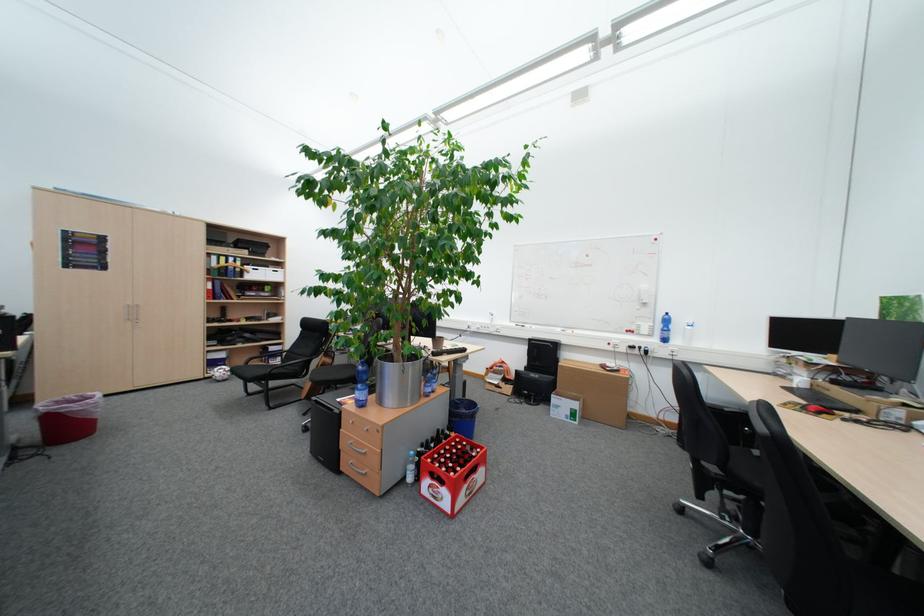
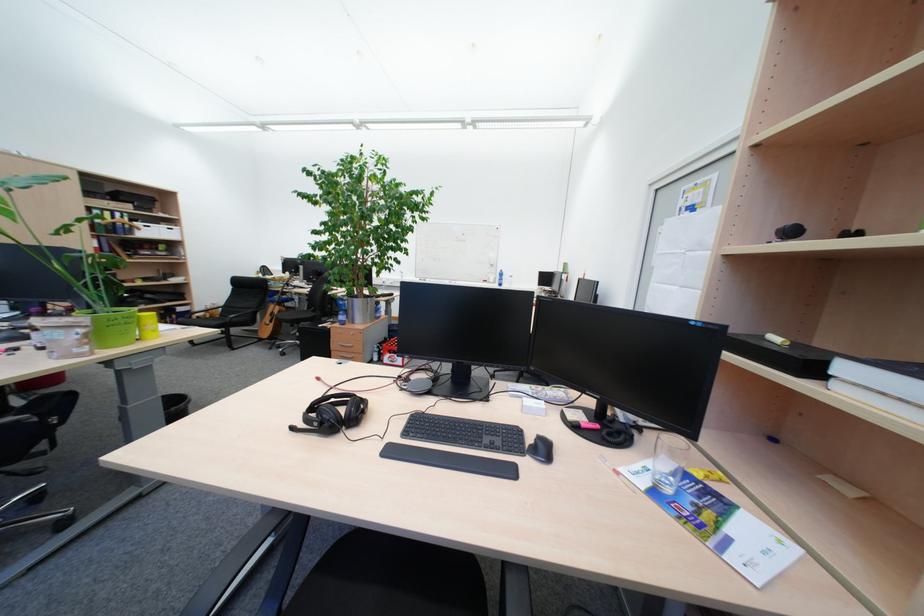
What movement of the cameraman would produce the second image?

The cameraman moved toward left, backward.